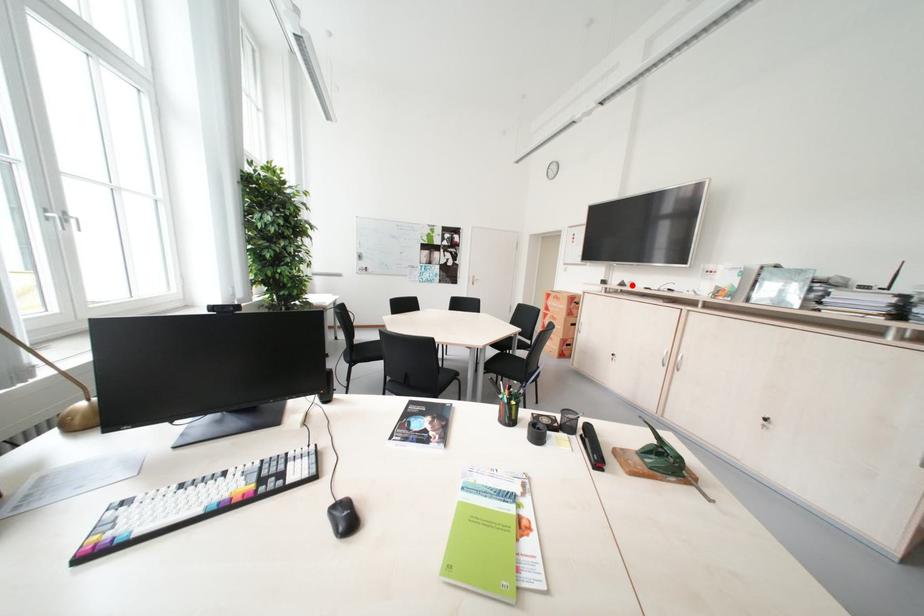
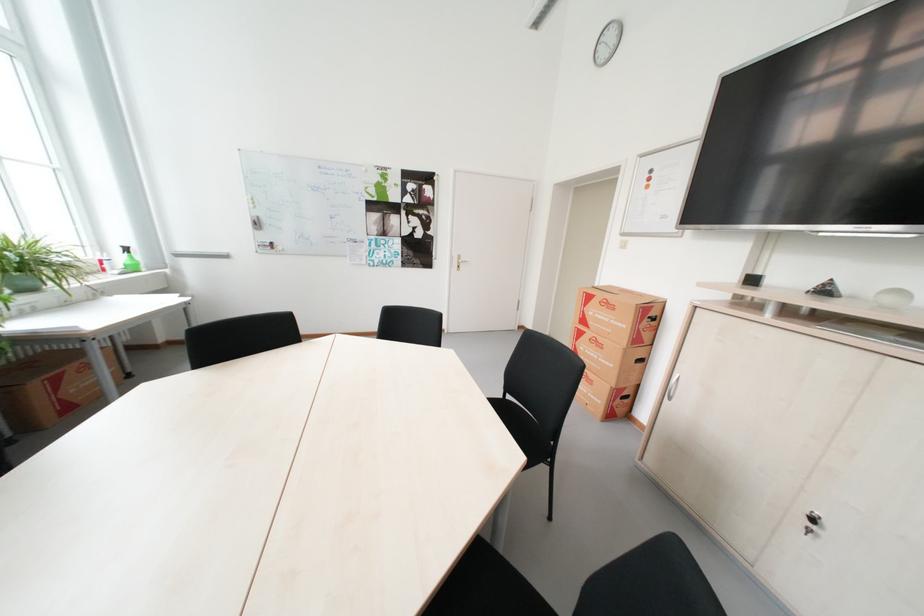
Locate, in the second image, the point that corresponds to the highlighted location in the first image.

(835, 292)